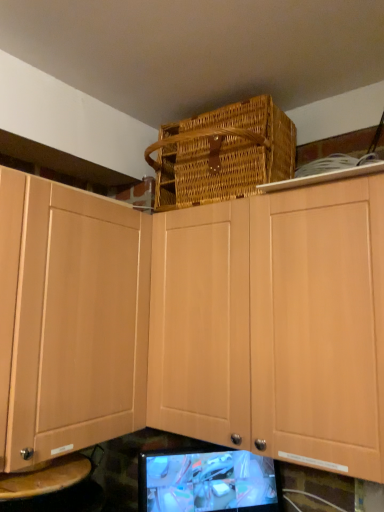
Question: Is matte black monitor at lower center thinner than light wood cabinet at upper center?

Choices:
 (A) yes
 (B) no

Answer: (A)

Question: Is matte black monitor at lower center next to light wood cabinet at upper center?

Choices:
 (A) no
 (B) yes

Answer: (A)

Question: Is matte black monitor at lower center completely or partially outside of light wood cabinet at upper center?

Choices:
 (A) no
 (B) yes

Answer: (B)

Question: Does matte black monitor at lower center have a lesser height compared to light wood cabinet at upper center?

Choices:
 (A) yes
 (B) no

Answer: (A)

Question: Does matte black monitor at lower center turn towards light wood cabinet at upper center?

Choices:
 (A) no
 (B) yes

Answer: (A)

Question: From the image's perspective, is matte black monitor at lower center on light wood cabinet at upper center?

Choices:
 (A) no
 (B) yes

Answer: (A)

Question: Is woven brown basket at upper center further to the viewer compared to light wood cabinet at upper center?

Choices:
 (A) no
 (B) yes

Answer: (B)

Question: Can you confirm if woven brown basket at upper center is bigger than light wood cabinet at upper center?

Choices:
 (A) yes
 (B) no

Answer: (B)

Question: Considering the relative positions of woven brown basket at upper center and light wood cabinet at upper center in the image provided, is woven brown basket at upper center to the left of light wood cabinet at upper center from the viewer's perspective?

Choices:
 (A) no
 (B) yes

Answer: (B)

Question: Would you consider woven brown basket at upper center to be distant from light wood cabinet at upper center?

Choices:
 (A) yes
 (B) no

Answer: (B)

Question: Could light wood cabinet at upper center be considered to be inside woven brown basket at upper center?

Choices:
 (A) no
 (B) yes

Answer: (A)

Question: From the image's perspective, would you say woven brown basket at upper center is positioned over light wood cabinet at upper center?

Choices:
 (A) no
 (B) yes

Answer: (B)

Question: Is matte black monitor at lower center at the back of light wood cabinet at upper center?

Choices:
 (A) yes
 (B) no

Answer: (B)